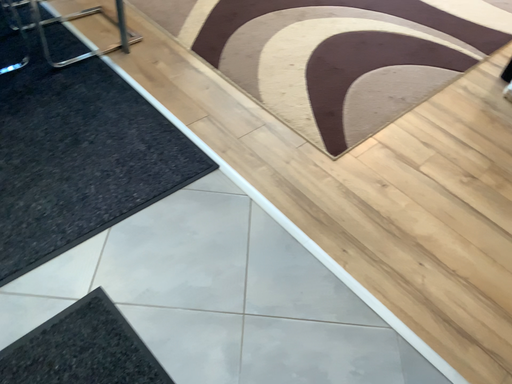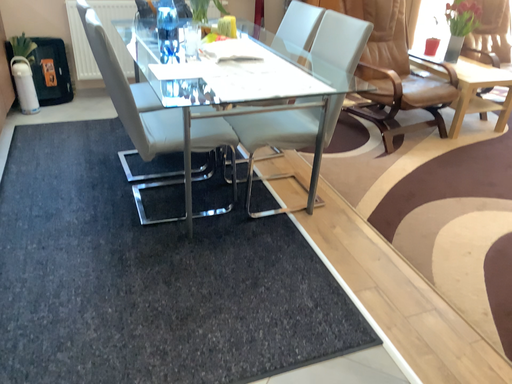
Question: How did the camera likely rotate when shooting the video?

Choices:
 (A) rotated left
 (B) rotated right

Answer: (A)